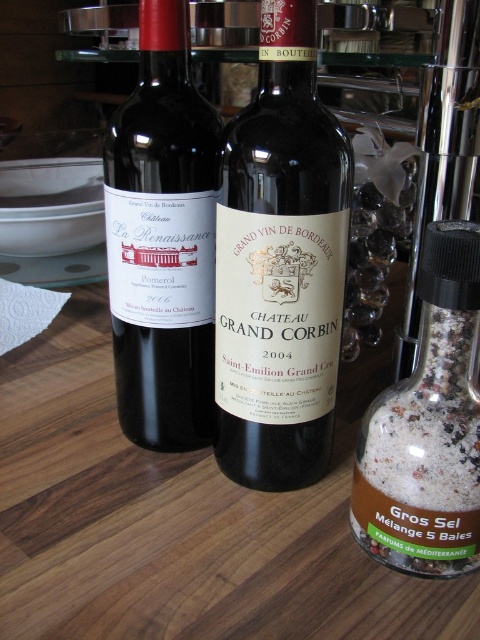
Can you confirm if matte black bottle at left is wider than white granular salt at right?

Indeed, matte black bottle at left has a greater width compared to white granular salt at right.

Is point (146, 268) positioned after point (460, 237)?

That is True.

Is point (170, 296) closer to viewer compared to point (444, 220)?

No, (170, 296) is behind (444, 220).

The width and height of the screenshot is (480, 640). In order to click on matte black bottle at left in this screenshot , I will do `click(163, 241)`.

Is matte black bottle at center closer to the viewer compared to matte black bottle at left?

Yes.

Is point (310, 19) farther from viewer compared to point (172, 170)?

No, (310, 19) is in front of (172, 170).

This screenshot has width=480, height=640. I want to click on matte black bottle at center, so click(x=280, y=266).

Which is behind, point (323, 378) or point (435, 336)?

Point (323, 378)

Between point (248, 410) and point (477, 484), which one is positioned behind?

Point (248, 410)

At what (x,y) coordinates should I click in order to perform the action: click on matte black bottle at center. Please return your answer as a coordinate pair (x, y). The image size is (480, 640). Looking at the image, I should click on (280, 266).